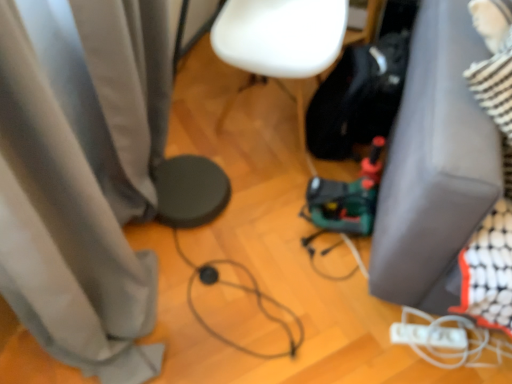
Question: Is white matte chair at center oriented towards gray fabric couch at lower right?

Choices:
 (A) yes
 (B) no

Answer: (B)

Question: Is white matte chair at center not within gray fabric couch at lower right?

Choices:
 (A) yes
 (B) no

Answer: (A)

Question: Is white matte chair at center thinner than gray fabric couch at lower right?

Choices:
 (A) no
 (B) yes

Answer: (B)

Question: Does white matte chair at center have a greater height compared to gray fabric couch at lower right?

Choices:
 (A) no
 (B) yes

Answer: (A)

Question: From the image's perspective, is white matte chair at center under gray fabric couch at lower right?

Choices:
 (A) no
 (B) yes

Answer: (A)

Question: From the image's perspective, is gray fabric couch at lower right positioned above or below white matte wii controller at lower right?

Choices:
 (A) above
 (B) below

Answer: (A)

Question: Is gray fabric couch at lower right wider or thinner than white matte wii controller at lower right?

Choices:
 (A) thin
 (B) wide

Answer: (B)

Question: Considering the positions of point (394, 144) and point (452, 344), is point (394, 144) closer or farther from the camera than point (452, 344)?

Choices:
 (A) closer
 (B) farther

Answer: (B)

Question: Considering the positions of gray fabric couch at lower right and white matte wii controller at lower right in the image, is gray fabric couch at lower right bigger or smaller than white matte wii controller at lower right?

Choices:
 (A) small
 (B) big

Answer: (B)

Question: From the image's perspective, is white matte wii controller at lower right above or below black cable at center?

Choices:
 (A) above
 (B) below

Answer: (B)

Question: Is white matte wii controller at lower right to the left or to the right of black cable at center in the image?

Choices:
 (A) right
 (B) left

Answer: (A)

Question: In terms of width, does white matte wii controller at lower right look wider or thinner when compared to black cable at center?

Choices:
 (A) thin
 (B) wide

Answer: (A)

Question: From a real-world perspective, is white matte wii controller at lower right above or below black cable at center?

Choices:
 (A) below
 (B) above

Answer: (B)

Question: In terms of size, does white matte chair at center appear bigger or smaller than black cable at center?

Choices:
 (A) big
 (B) small

Answer: (A)

Question: Considering the positions of white matte chair at center and black cable at center in the image, is white matte chair at center taller or shorter than black cable at center?

Choices:
 (A) tall
 (B) short

Answer: (A)